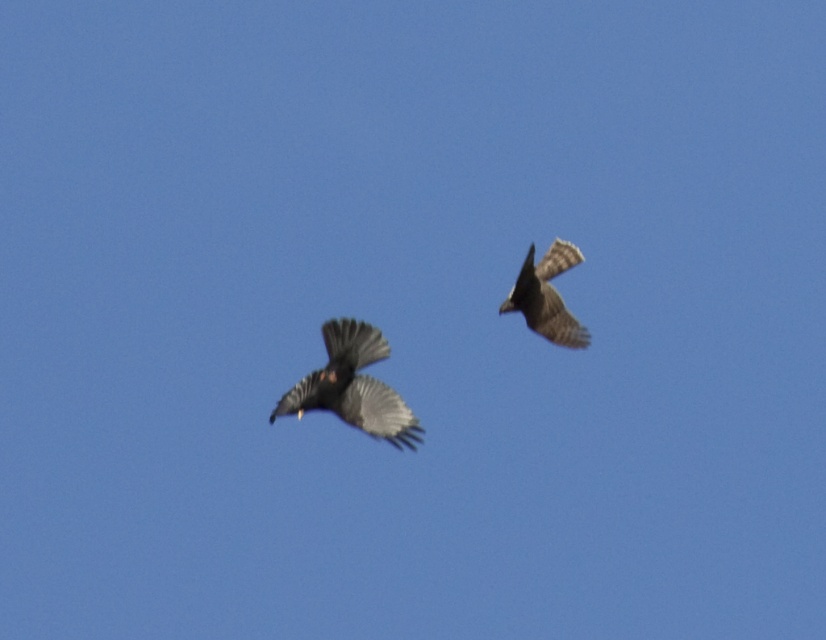
Does point (363, 337) come farther from viewer compared to point (554, 262)?

No, it is not.

Is point (339, 388) positioned in front of point (563, 252)?

Yes.

Image resolution: width=826 pixels, height=640 pixels. Find the location of `matte black crow at center`. matte black crow at center is located at coordinates (352, 387).